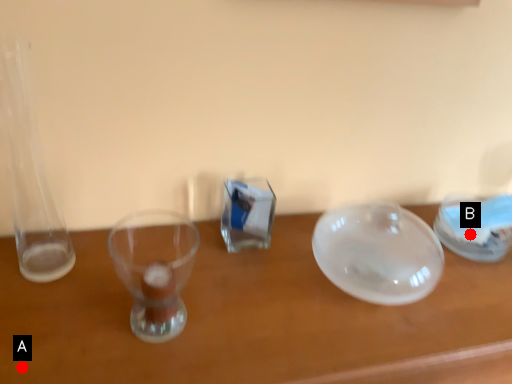
Question: Two points are circled on the image, labeled by A and B beside each circle. Among these points, which one is nearest to the camera?

Choices:
 (A) A is closer
 (B) B is closer

Answer: (A)